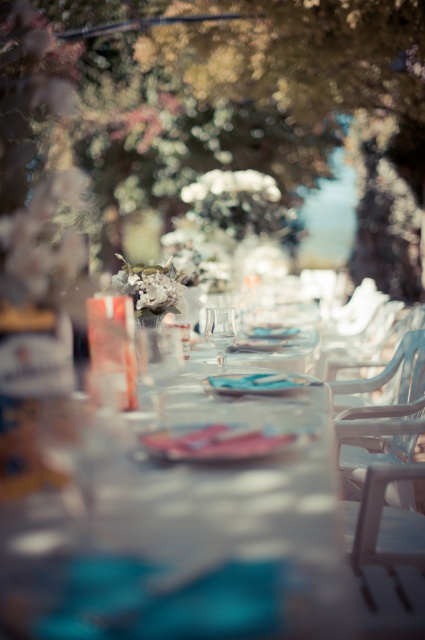
Question: Which object is positioned closest to the matte pink platter at center?

Choices:
 (A) transparent glass wine glass at center
 (B) white glossy table at center
 (C) white plastic chair at center

Answer: (B)

Question: Can you confirm if blue matte plate at center is positioned below transparent glass wine glass at center?

Choices:
 (A) yes
 (B) no

Answer: (A)

Question: Does white glossy table at center appear under blue matte plate at center?

Choices:
 (A) no
 (B) yes

Answer: (A)

Question: Is green leafy tree at upper center below clear glass wine glass at center?

Choices:
 (A) yes
 (B) no

Answer: (B)

Question: Estimate the real-world distances between objects in this image. Which object is farther from the clear glass wine glass at center?

Choices:
 (A) transparent glass wine glass at center
 (B) blue matte plate at center

Answer: (A)

Question: Which of the following is the closest to the observer?

Choices:
 (A) (170, 374)
 (B) (138, 49)

Answer: (A)